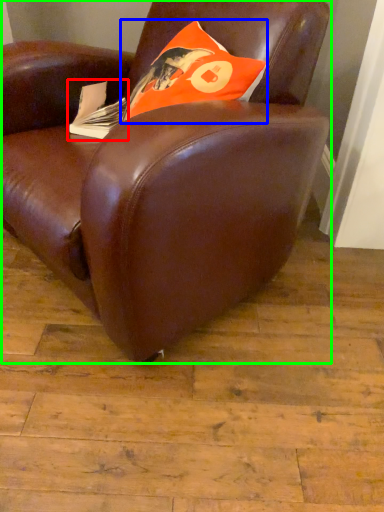
Question: Considering the real-world distances, which object is closest to paperback book (highlighted by a red box)? throw pillow (highlighted by a blue box) or chair (highlighted by a green box).

Choices:
 (A) throw pillow
 (B) chair

Answer: (A)